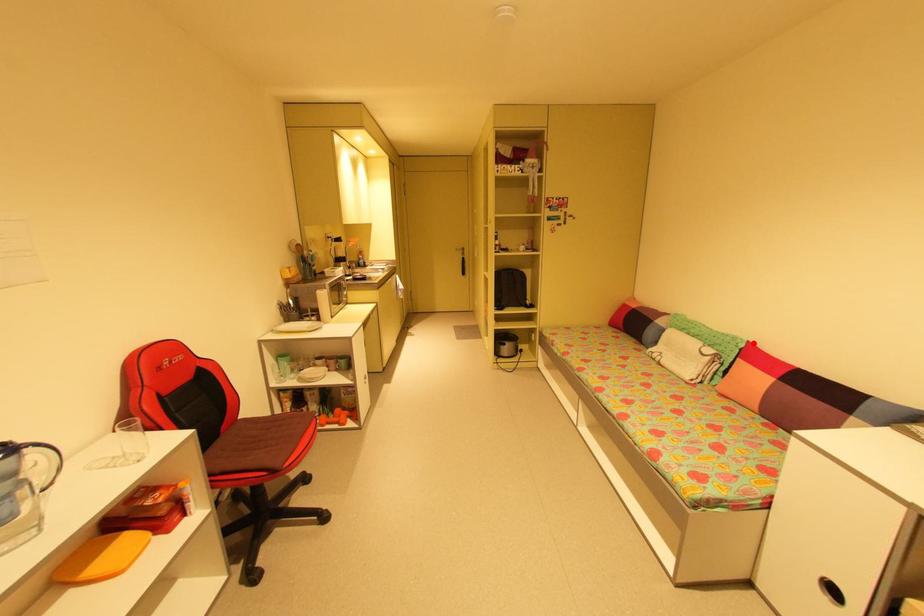
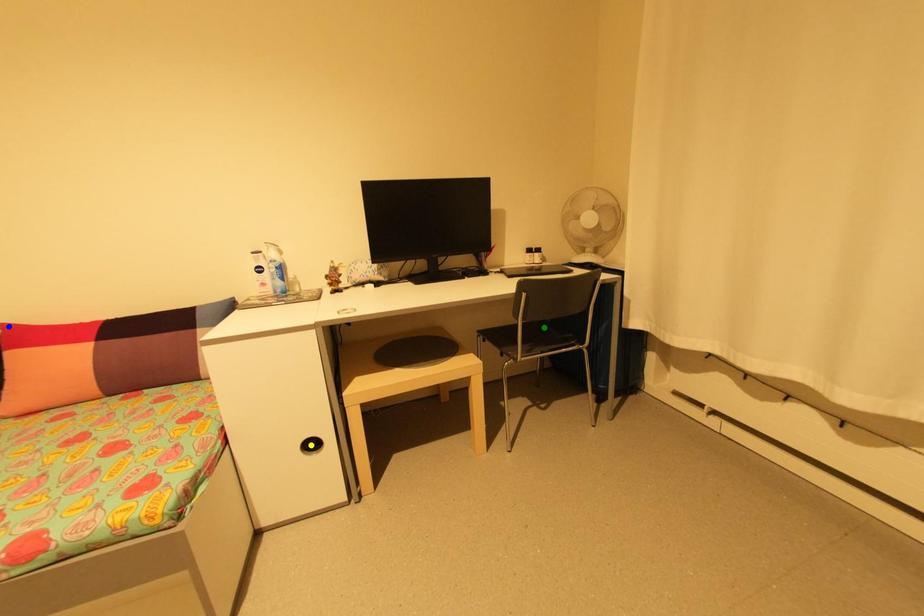
Question: I am providing you with two images of the same scene from different viewpoints. A red point is marked on the first image. You are given multiple points on the second image. Can you choose the point in image 2 that corresponds to the point in image 1?

Choices:
 (A) green point
 (B) yellow point
 (C) blue point

Answer: (C)